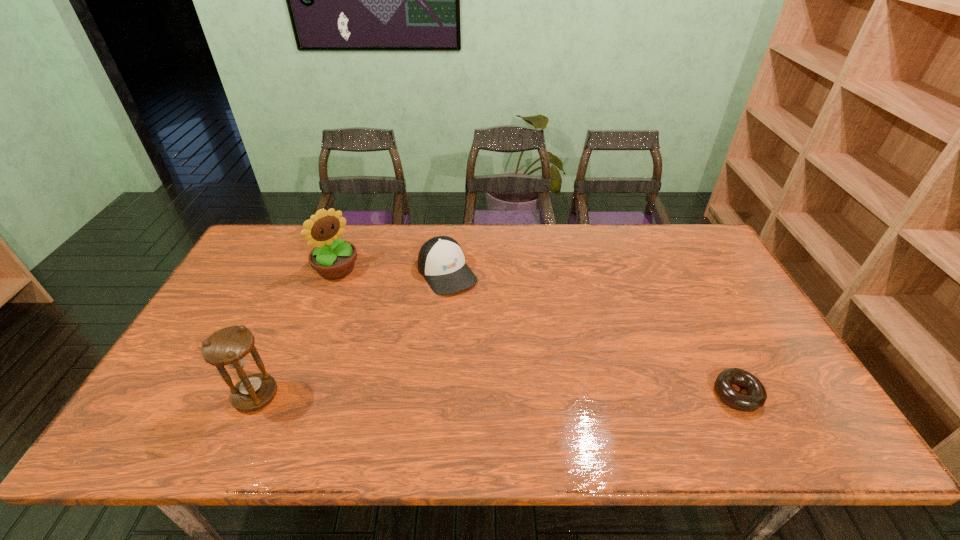
Identify the location of vacant space at the far edge of the desktop. Image resolution: width=960 pixels, height=540 pixels. (653, 248).

This screenshot has width=960, height=540. Identify the location of free space at the near edge of the desktop. (665, 388).

What are the coordinates of `vacant position at the left edge of the desktop` in the screenshot? It's located at (206, 315).

I want to click on vacant space at the right edge of the desktop, so click(730, 306).

Find the location of a particular element. vacant point at the far left corner is located at coordinates (282, 225).

Image resolution: width=960 pixels, height=540 pixels. Identify the location of vacant position at the far right corner of the desktop. (687, 248).

Locate an element on the screen. This screenshot has height=540, width=960. unoccupied position between the sunflower and the third object from left to right is located at coordinates (392, 271).

Locate an element on the screen. vacant space that's between the doughnut and the cap is located at coordinates (x=592, y=334).

Locate an element on the screen. The width and height of the screenshot is (960, 540). free space between the sunflower and the hourglass is located at coordinates (297, 332).

This screenshot has height=540, width=960. In order to click on vacant area that lies between the sunflower and the shortest object in this screenshot , I will do `click(537, 332)`.